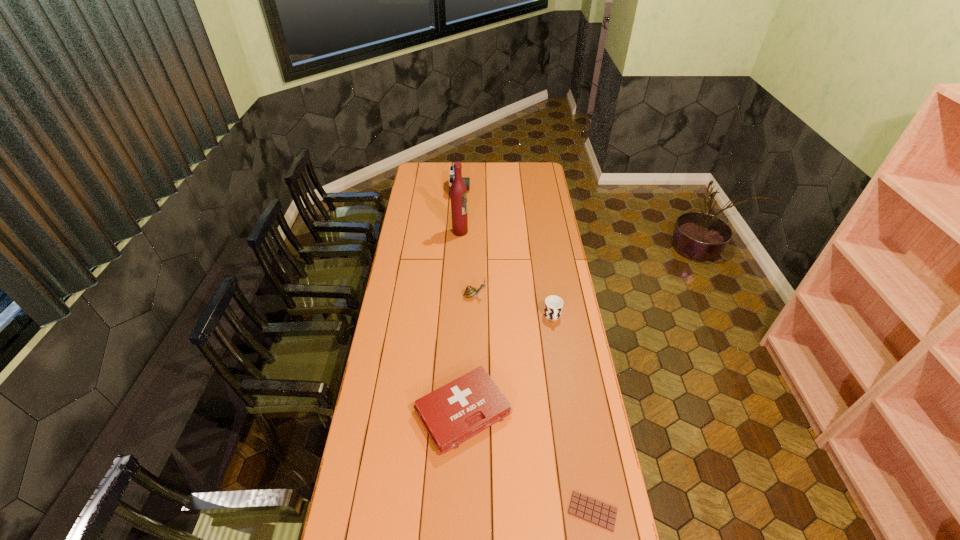
Image resolution: width=960 pixels, height=540 pixels. What are the coordinates of `free location located on the label of the tallest object` in the screenshot? It's located at (527, 232).

Where is `vacant region located 0.110m on the front-facing side of the farthest object`? The image size is (960, 540). vacant region located 0.110m on the front-facing side of the farthest object is located at coordinates (488, 190).

This screenshot has height=540, width=960. What are the coordinates of `vacant space situated 0.200m on the face of the fourth nearest object` in the screenshot? It's located at (529, 295).

At what (x,y) coordinates should I click in order to perform the action: click on free space located 0.090m on the side of the third shortest object with the handle. Please return your answer as a coordinate pair (x, y). Looking at the image, I should click on (557, 342).

Image resolution: width=960 pixels, height=540 pixels. I want to click on vacant space located 0.220m on the back of the first-aid kit, so click(x=466, y=329).

Find the location of `free space located 0.220m on the back of the shortest object`. free space located 0.220m on the back of the shortest object is located at coordinates (578, 427).

At what (x,y) coordinates should I click in order to perform the action: click on object that is at the far edge. Please return your answer as a coordinate pair (x, y). The image size is (960, 540). Looking at the image, I should click on (466, 180).

You are a GUI agent. You are given a task and a screenshot of the screen. Output one action in this format:
    pyautogui.click(x=<x>, y=<y>)
    Task: Click on the cup situated at the right edge
    The image size is (960, 540).
    Given the screenshot: What is the action you would take?
    pyautogui.click(x=553, y=306)

Identify the location of candy bar located in the right edge section of the desktop. The image size is (960, 540). (601, 514).

At what (x,y) coordinates should I click in order to perform the action: click on free space at the far edge. Please return your answer as a coordinate pair (x, y). Looking at the image, I should click on tap(448, 181).